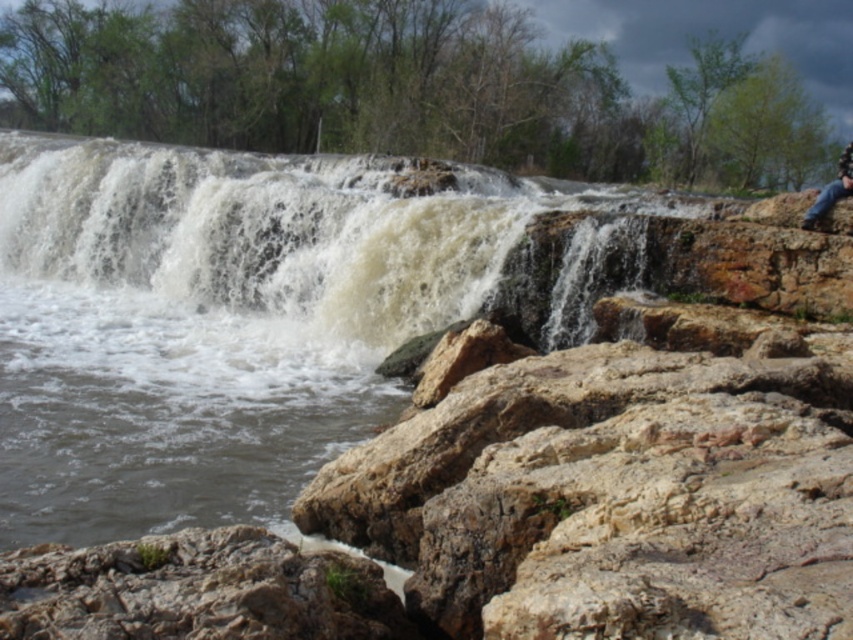
You are standing at the base of the waterfall and want to take a photo. You notice two points marked in the scene. The first point is at coordinates point (178, 340), and the second is at point (802, 220). Which of these points is closer to your camera lens?

Point (178, 340) is further to the camera than point (802, 220), so the second point at point (802, 220) is closer to the camera lens.

You are standing near the waterfall and see the white frothy water at center and the jeans at right. Which object is taller?

The jeans at right are taller than the white frothy water at center.

You are hiking near the waterfall and see the white frothy water at center and the jeans at right. Which object is larger in size?

The jeans at right are larger in size than the white frothy water at center.